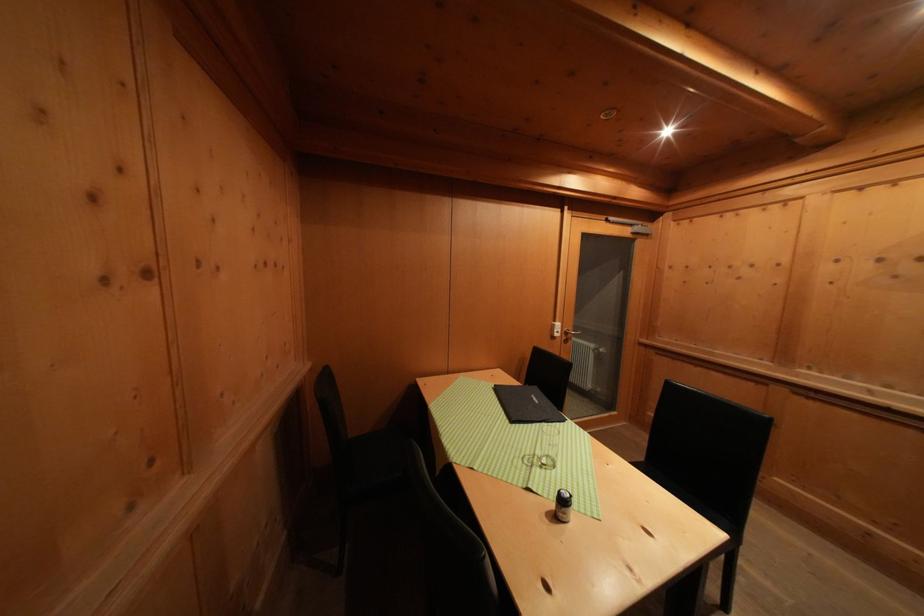
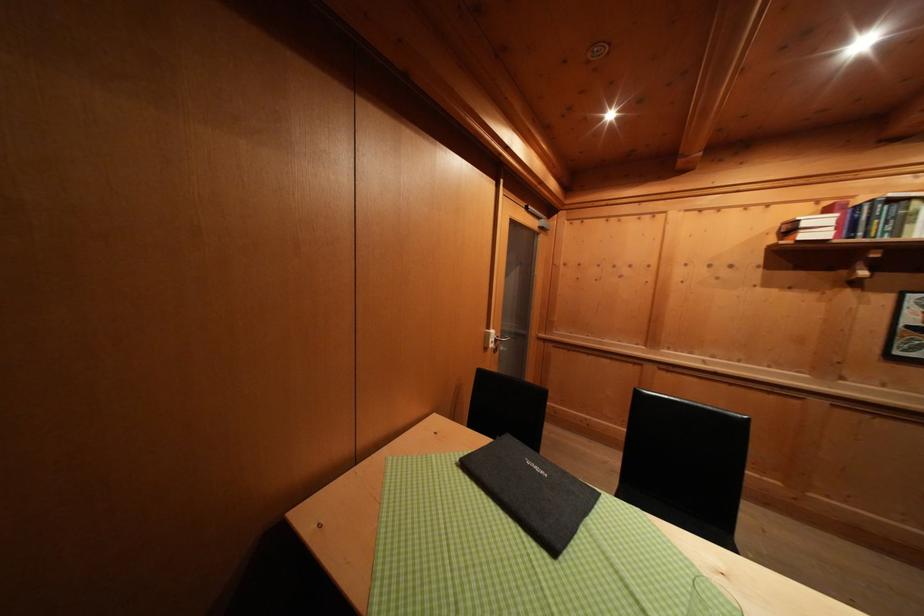
Question: The first image is from the beginning of the video and the second image is from the end. How did the camera likely rotate when shooting the video?

Choices:
 (A) Left
 (B) Right
 (C) Up
 (D) Down

Answer: (B)